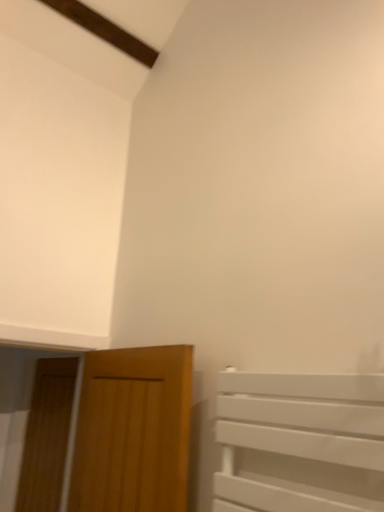
Question: Is wooden door at left, which ranks as the 1th door in left-to-right order, inside or outside of wooden door at lower left, marked as the 2th door in a left-to-right arrangement?

Choices:
 (A) outside
 (B) inside

Answer: (A)

Question: Looking at their shapes, would you say wooden door at left, which ranks as the 1th door in left-to-right order, is wider or thinner than wooden door at lower left, the first door from the front?

Choices:
 (A) thin
 (B) wide

Answer: (A)

Question: From the image's perspective, is wooden door at left, which is the first door in back-to-front order, above or below wooden door at lower left, marked as the 2th door in a left-to-right arrangement?

Choices:
 (A) above
 (B) below

Answer: (B)

Question: From the image's perspective, is wooden door at lower left, marked as the 2th door in a left-to-right arrangement, positioned above or below wooden door at left, which ranks as the 1th door in left-to-right order?

Choices:
 (A) below
 (B) above

Answer: (B)

Question: In terms of width, does wooden door at lower left, marked as the 2th door in a left-to-right arrangement, look wider or thinner when compared to wooden door at left, which is the first door in back-to-front order?

Choices:
 (A) wide
 (B) thin

Answer: (A)

Question: Is wooden door at lower left, the second door in the back-to-front sequence, in front of or behind wooden door at left, acting as the 2th door starting from the right, in the image?

Choices:
 (A) front
 (B) behind

Answer: (A)

Question: Considering the positions of point (107, 501) and point (61, 437), is point (107, 501) closer or farther from the camera than point (61, 437)?

Choices:
 (A) closer
 (B) farther

Answer: (A)